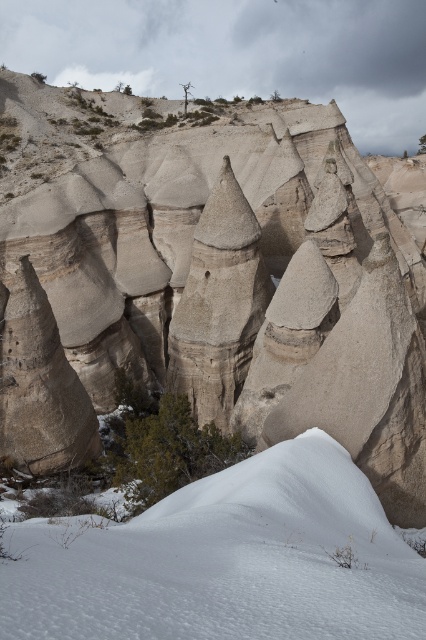
Is point (51, 179) less distant than point (316, 445)?

No, it is not.

Who is lower down, smooth sandstone rock formation at center or white fluffy snow at lower center?

white fluffy snow at lower center

What do you see at coordinates (224, 266) in the screenshot? I see `smooth sandstone rock formation at center` at bounding box center [224, 266].

This screenshot has width=426, height=640. Identify the location of smooth sandstone rock formation at center. (224, 266).